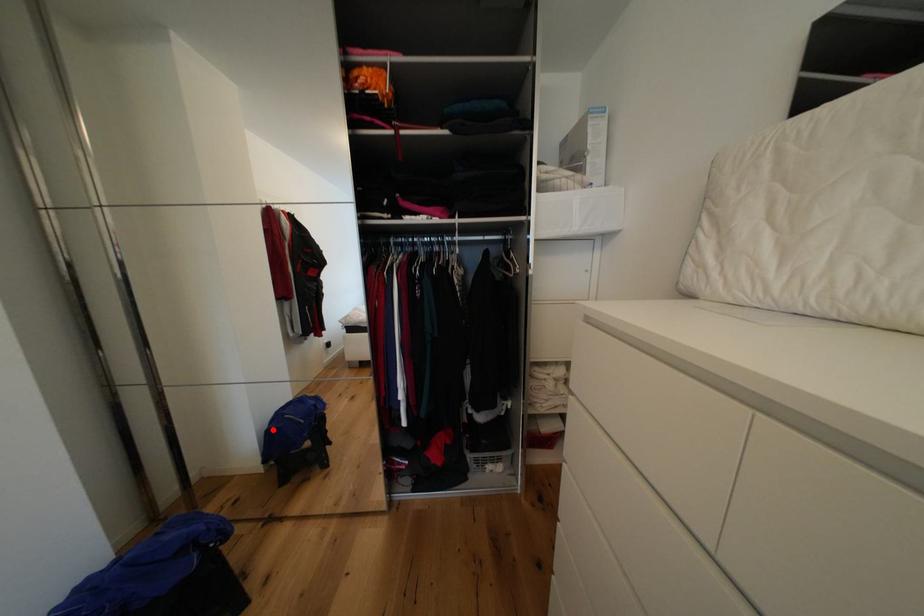
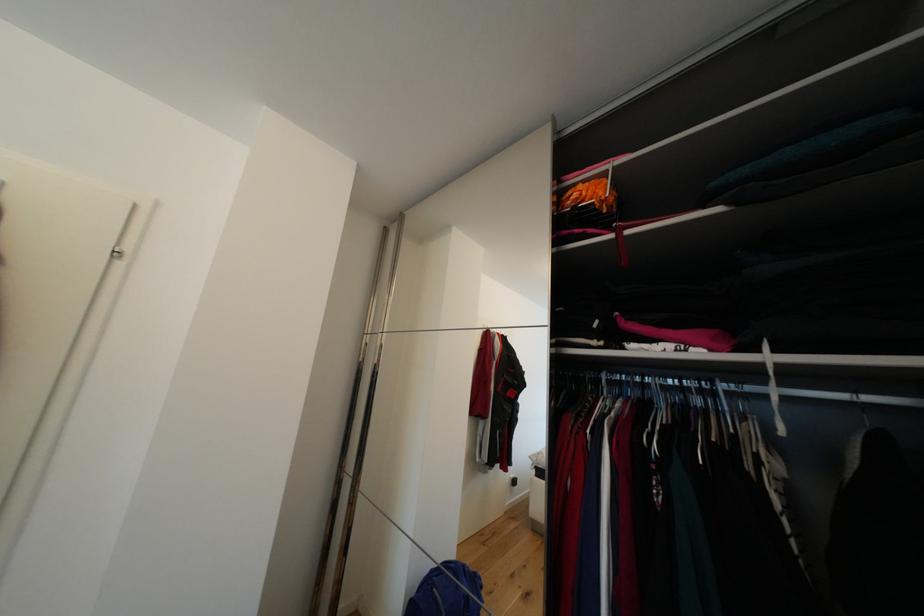
Locate, in the second image, the point that corresponds to the highlighted location in the first image.

(421, 592)